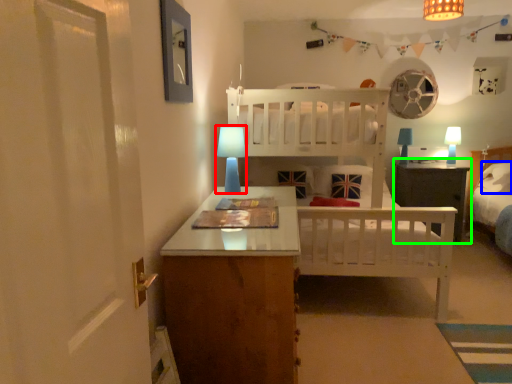
Question: Which is nearer to the table lamp (highlighted by a red box)? pillow (highlighted by a blue box) or nightstand (highlighted by a green box).

Choices:
 (A) pillow
 (B) nightstand

Answer: (B)